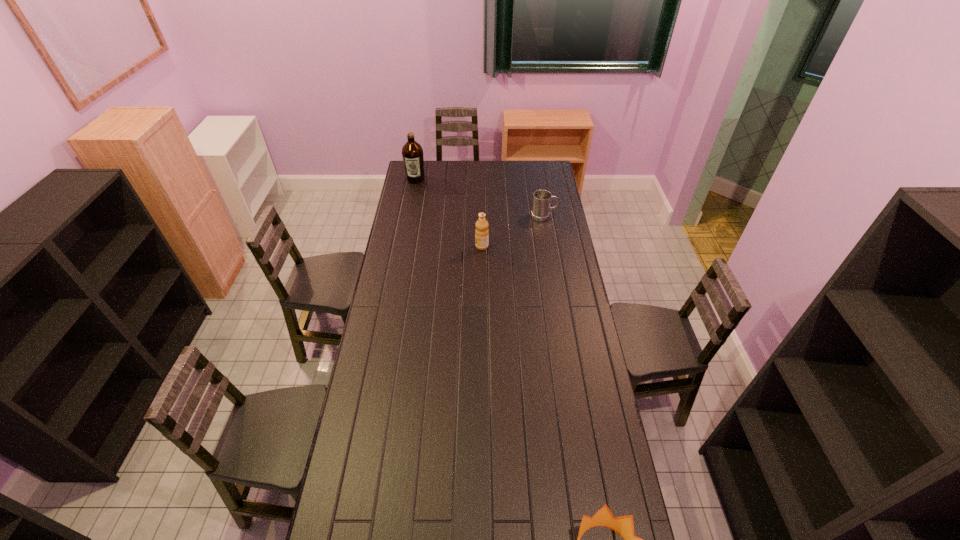
In order to click on object that is at the left edge in this screenshot , I will do `click(412, 153)`.

Locate an element on the screen. object present at the right edge is located at coordinates (541, 208).

At what (x,y) coordinates should I click in order to perform the action: click on object present at the far left corner. Please return your answer as a coordinate pair (x, y). Looking at the image, I should click on (412, 153).

Where is `free space at the far edge`? The width and height of the screenshot is (960, 540). free space at the far edge is located at coordinates (492, 165).

Find the location of `free space at the left edge of the desktop`. free space at the left edge of the desktop is located at coordinates (405, 242).

Identify the location of free space at the right edge of the desktop. The image size is (960, 540). pos(578,399).

The image size is (960, 540). What are the coordinates of `blank space at the far right corner of the desktop` in the screenshot? It's located at (545, 167).

Find the location of a particular element. This screenshot has width=960, height=540. free space between the second farthest object and the left olive oil is located at coordinates (480, 198).

Locate an element on the screen. The width and height of the screenshot is (960, 540). free spot between the third nearest object and the second tallest object is located at coordinates (513, 231).

Identify the location of empty space between the shorter olive oil and the leftmost object. This screenshot has height=540, width=960. (448, 213).